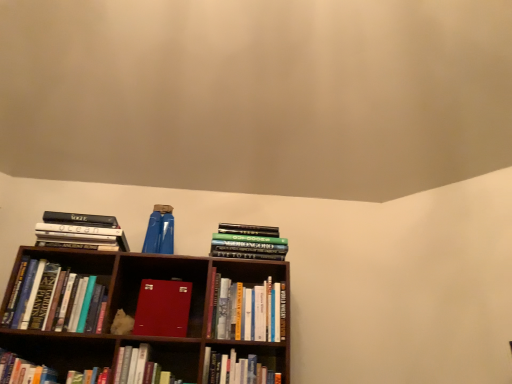
Question: Is hardcover book at lower center, placed as the 5th book when sorted from left to right, wider or thinner than hardcover books at left, arranged as the 6th book when viewed from the right?

Choices:
 (A) wide
 (B) thin

Answer: (B)

Question: From the image's perspective, relative to hardcover books at left, arranged as the 6th book when viewed from the right, is hardcover book at lower center, arranged as the fourth book when viewed from the right, above or below?

Choices:
 (A) above
 (B) below

Answer: (B)

Question: Estimate the real-world distances between objects in this image. Which object is closer to the hardcover book at center, the 7th book from the left?

Choices:
 (A) matte red book at center, marked as the fifth book in a right-to-left arrangement
 (B) hardcover book at lower center, which is the sixth book from left to right
 (C) hardcover book at lower center, arranged as the fourth book when viewed from the right
 (D) hardcover book at lower left, which is the 7th book in right-to-left order
 (E) hardcover books at left, arranged as the 6th book when viewed from the right

Answer: (B)

Question: Which object is positioned farthest from the green matte book at center, which ranks as the first book in right-to-left order?

Choices:
 (A) hardcover book at lower center, which is the sixth book from left to right
 (B) hardcover books at left, marked as the third book in a left-to-right arrangement
 (C) hardcover book at center, the 7th book from the left
 (D) hardcover book at lower left, which is the 7th book in right-to-left order
 (E) matte red book at center, which appears as the fourth book when viewed from the left

Answer: (D)